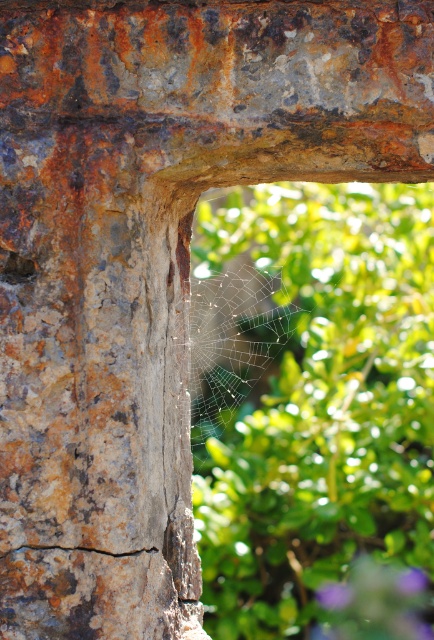
Question: Is the position of purple matte flower at lower right more distant than that of rusty metal crack at lower left?

Choices:
 (A) yes
 (B) no

Answer: (A)

Question: Where is transparent silk spider web at center located in relation to purple matte flower at lower right in the image?

Choices:
 (A) left
 (B) right

Answer: (A)

Question: Based on their relative distances, which object is nearer to the purple matte flower at lower right?

Choices:
 (A) rusty metal hole at left
 (B) transparent silk spider web at center
 (C) rusty metal crack at lower left

Answer: (B)

Question: Is transparent silk spider web at center positioned before purple matte flower at lower right?

Choices:
 (A) no
 (B) yes

Answer: (A)

Question: Which object is closer to the camera taking this photo?

Choices:
 (A) purple matte flower at lower right
 (B) rusty metal hole at left
 (C) rusty metal crack at lower left
 (D) transparent silk spider web at center

Answer: (B)

Question: Which of the following is the closest to the observer?

Choices:
 (A) purple matte flower at lower right
 (B) rusty metal crack at lower left
 (C) rusty metal hole at left
 (D) transparent silk spider web at center

Answer: (C)